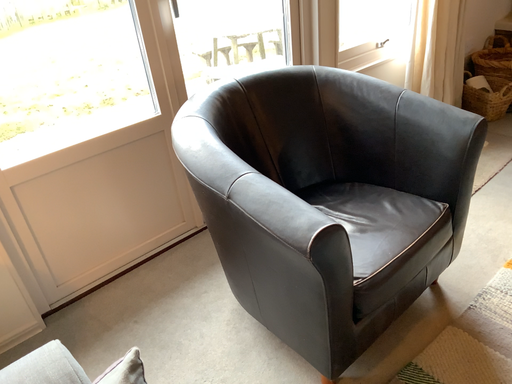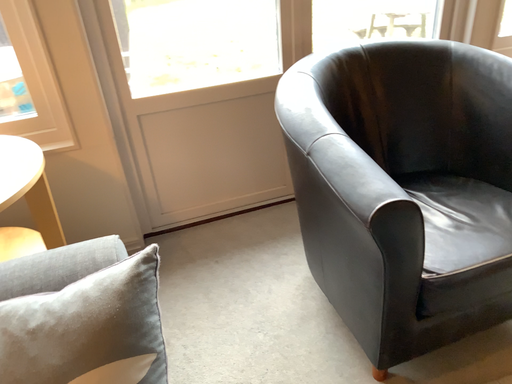
Question: Which way did the camera rotate in the video?

Choices:
 (A) rotated left
 (B) rotated right

Answer: (A)